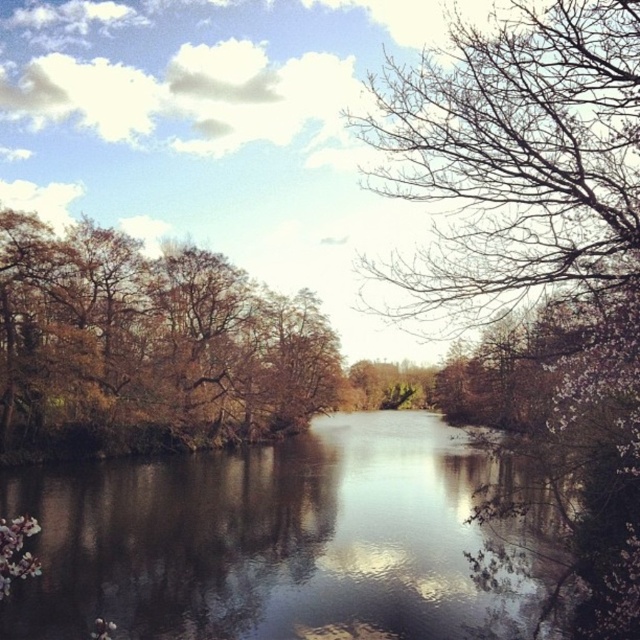
Question: In this image, where is brown reflective water at center located relative to bare branches at upper right?

Choices:
 (A) left
 (B) right

Answer: (A)

Question: Is brown reflective water at center positioned before brown leafy trees at left?

Choices:
 (A) no
 (B) yes

Answer: (B)

Question: Among these points, which one is nearest to the camera?

Choices:
 (A) (579, 186)
 (B) (134, 272)

Answer: (A)

Question: Among these objects, which one is nearest to the camera?

Choices:
 (A) brown leafy trees at left
 (B) bare branches at upper right

Answer: (B)

Question: Can you confirm if brown reflective water at center is positioned to the left of brown leafy trees at left?

Choices:
 (A) yes
 (B) no

Answer: (B)

Question: Which of the following is the farthest from the observer?

Choices:
 (A) bare branches at upper right
 (B) brown leafy trees at left
 (C) brown reflective water at center

Answer: (B)